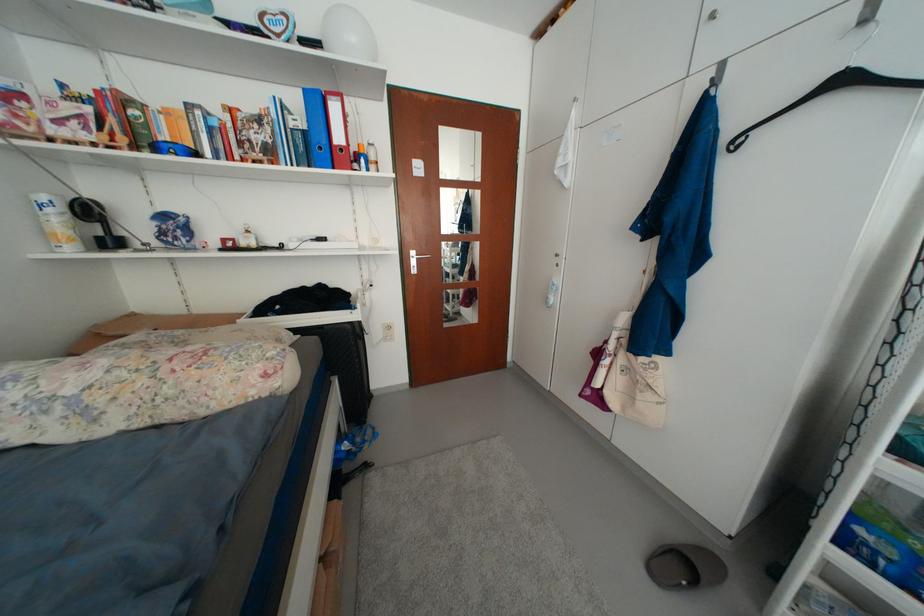
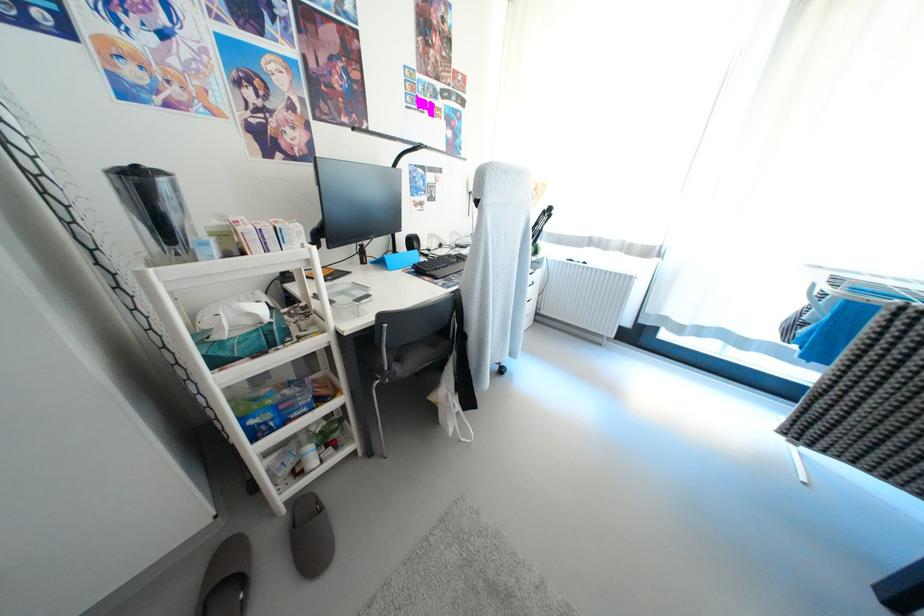
The first image is from the beginning of the video and the second image is from the end. How did the camera likely rotate when shooting the video?

The camera rotated toward right-down.